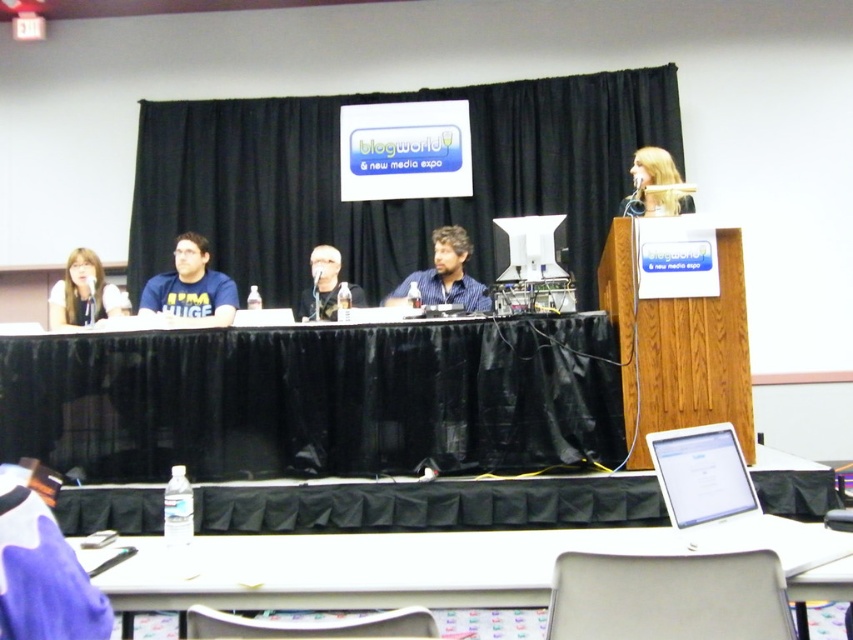
Is point (231, 301) in front of point (93, 259)?

Yes, point (231, 301) is in front of point (93, 259).

Between blue t-shirt at left and matte black hair at left, which one has more height?

Standing taller between the two is blue t-shirt at left.

This screenshot has width=853, height=640. Find the location of `blue t-shirt at left`. blue t-shirt at left is located at coordinates (190, 285).

Measure the distance between black fabric table at center and camera.

black fabric table at center and camera are 4.02 meters apart from each other.

Which of these two, black fabric table at center or silver metallic laptop at lower right, stands taller?

black fabric table at center is taller.

Measure the distance between black fabric table at center and camera.

They are 4.02 meters apart.

The width and height of the screenshot is (853, 640). Find the location of `black fabric table at center`. black fabric table at center is located at coordinates (316, 400).

Who is higher up, black fabric table at center or matte black microphone at center?

matte black microphone at center is higher up.

Who is lower down, black fabric table at center or matte black microphone at center?

black fabric table at center is below.

Is point (578, 428) farther from viewer compared to point (357, 288)?

No, (578, 428) is in front of (357, 288).

You are a GUI agent. You are given a task and a screenshot of the screen. Output one action in this format:
    pyautogui.click(x=<x>, y=<y>)
    Task: Click on the black fabric table at center
    This screenshot has width=853, height=640.
    Given the screenshot: What is the action you would take?
    tap(316, 400)